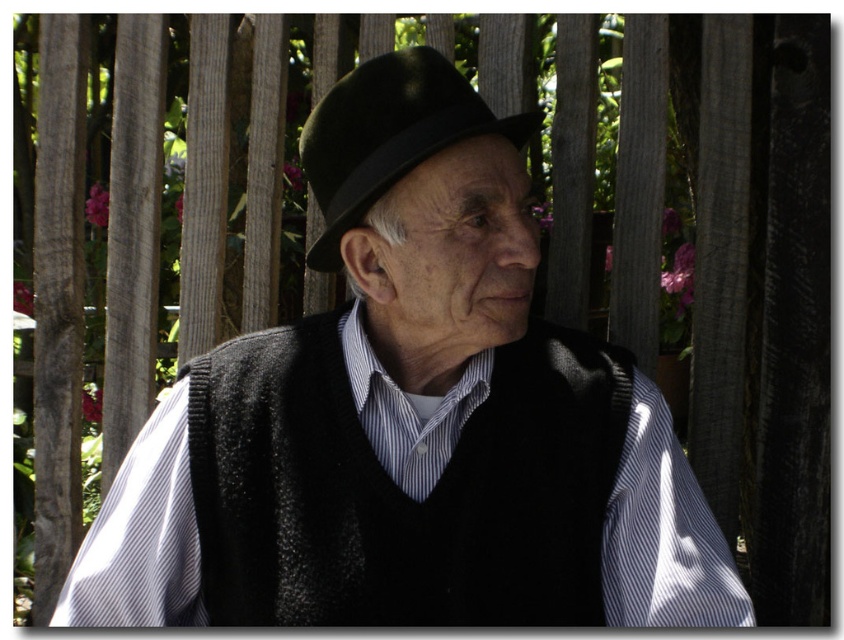
Does black knitted vest at center have a lesser width compared to black felt fedora at center?

No.

Who is lower down, black knitted vest at center or black felt fedora at center?

black knitted vest at center is lower down.

Is point (198, 385) less distant than point (339, 124)?

No, it is not.

This screenshot has width=844, height=640. In order to click on black knitted vest at center in this screenshot , I will do `click(399, 490)`.

Does black felt fedora at center appear on the right side of white striped fabric at center?

Incorrect, black felt fedora at center is not on the right side of white striped fabric at center.

Is black felt fedora at center positioned at the back of white striped fabric at center?

That is False.

Image resolution: width=844 pixels, height=640 pixels. I want to click on black felt fedora at center, so [x=388, y=134].

Identify the location of black felt fedora at center. (388, 134).

Describe the element at coordinates (399, 490) in the screenshot. Image resolution: width=844 pixels, height=640 pixels. I see `black knitted vest at center` at that location.

Does point (502, 573) come closer to viewer compared to point (410, 408)?

Yes, it is.

Where is `black knitted vest at center`? This screenshot has height=640, width=844. black knitted vest at center is located at coordinates click(x=399, y=490).

Where is `black knitted vest at center`? The image size is (844, 640). black knitted vest at center is located at coordinates (399, 490).